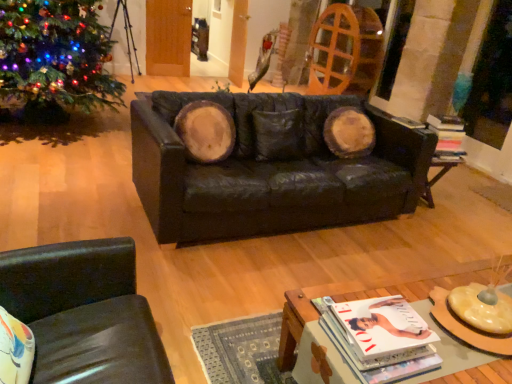
At what (x,y) coordinates should I click in order to perform the action: click on free space above matte white magazine at lower center, placed as the 2th magazine when sorted from top to bottom (from a real-world perspective). Please return your answer as a coordinate pair (x, y). This screenshot has width=512, height=384. Looking at the image, I should click on (378, 324).